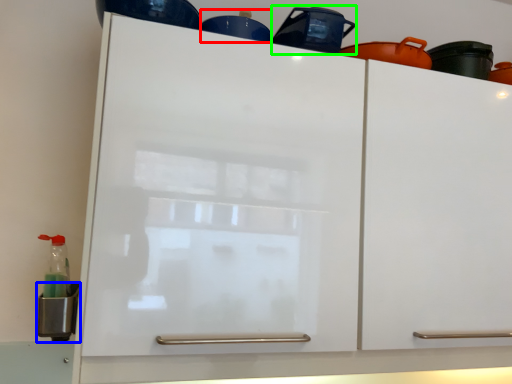
Question: Estimate the real-world distances between objects in this image. Which object is farther from appliance (highlighted by a red box), appliance (highlighted by a blue box) or appliance (highlighted by a green box)?

Choices:
 (A) appliance
 (B) appliance

Answer: (A)